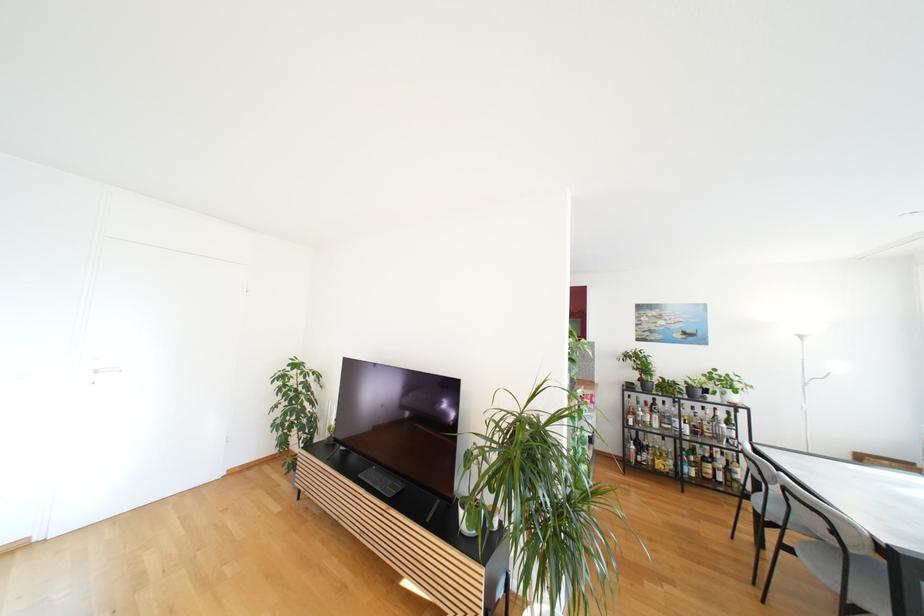
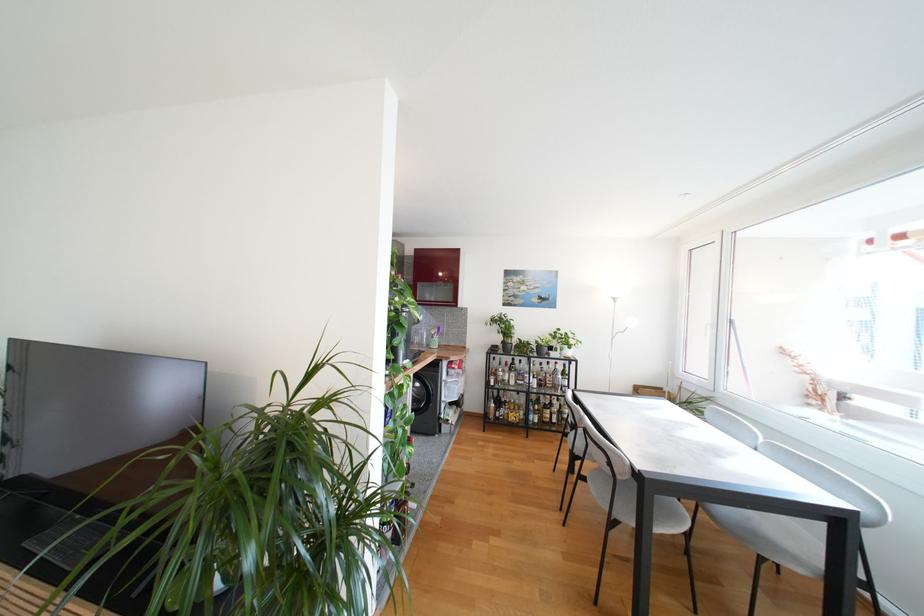
Find the pixel in the second image that matches point (794, 552) in the first image.

(589, 480)